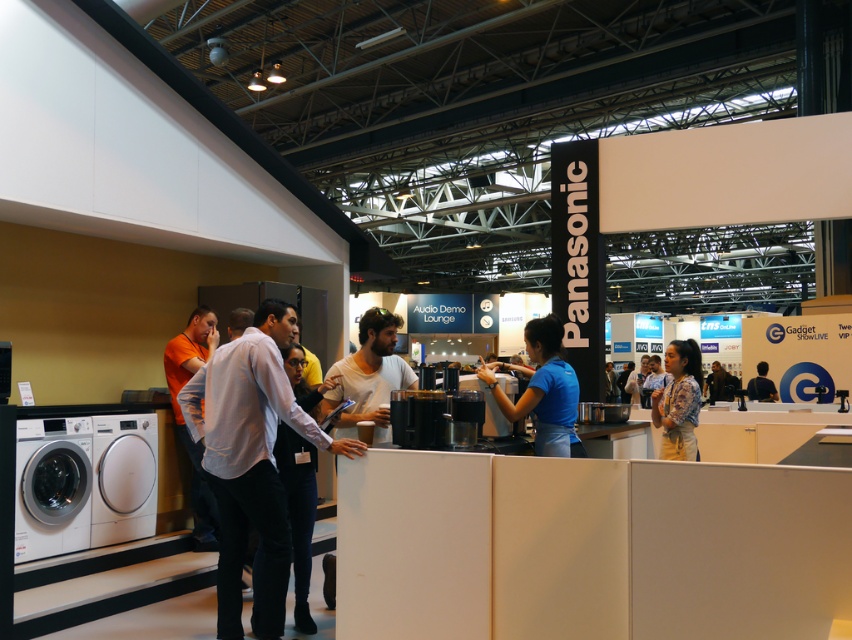
Question: Estimate the real-world distances between objects in this image. Which object is farther from the white glossy washing machine at lower left?

Choices:
 (A) satin silver washer at lower left
 (B) printed fabric blouse at center
 (C) white shirt at center
 (D) blue fabric shirt at center

Answer: (B)

Question: Can you confirm if white shirt at center is bigger than dark blue shirt at center?

Choices:
 (A) yes
 (B) no

Answer: (A)

Question: Among these objects, which one is nearest to the camera?

Choices:
 (A) white glossy washing machine at lower left
 (B) white shirt at center

Answer: (B)

Question: Which point appears closest to the camera in this image?

Choices:
 (A) (760, 396)
 (B) (694, 410)

Answer: (B)

Question: Considering the relative positions of white glossy washing machine at lower left and blue fabric shirt at center in the image provided, where is white glossy washing machine at lower left located with respect to blue fabric shirt at center?

Choices:
 (A) below
 (B) above

Answer: (A)

Question: Observing the image, what is the correct spatial positioning of blue fabric shirt at center in reference to dark blue shirt at center?

Choices:
 (A) left
 (B) right

Answer: (A)